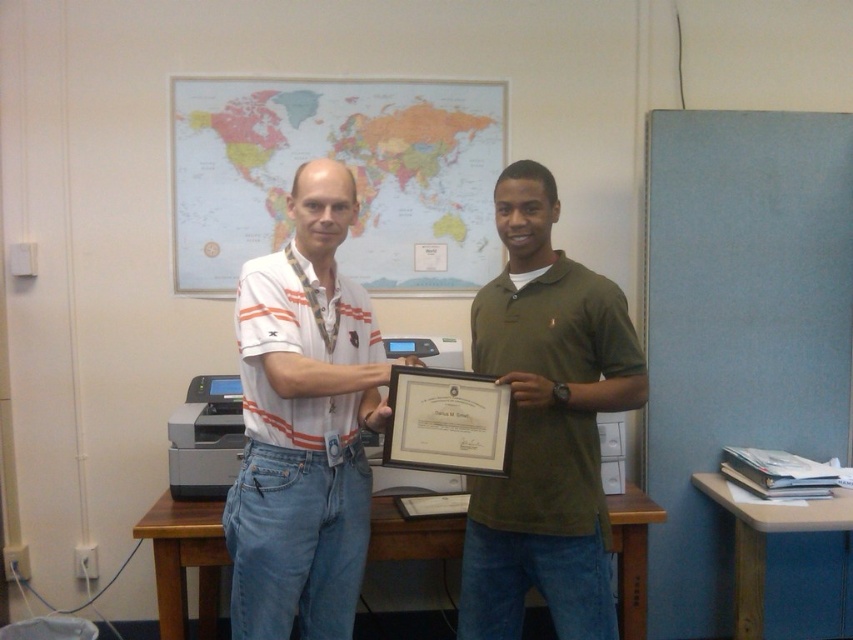
What are the coordinates of the white striped polo shirt at center?

The white striped polo shirt at center is located at coordinates point (305, 422).

You are standing in the office scene and need to place a small plant exactly at point (x=300, y=525). If you are currently 2 meters away from this point, how many steps backward should you take to be exactly at the point?

The distance of point (x=300, y=525) from viewer is 1.78 meters. Since you are currently 2 meters away, you need to move backward by 0.22 meters. Assuming each step covers about 0.5 meters, you would need to take 0.44 steps backward. However, since you can only take whole steps, rounding to the nearest whole number, you should take 0 step backward as you are already very close.

You are a photographer trying to capture a clear shot of both the white striped polo shirt at center and the green matte shirt at center. Since you want both shirts to be in focus, which one should you adjust your camera focus on first to ensure both are sharp?

You should focus on the white striped polo shirt at center first because it is closer to the viewer than the green matte shirt at center, ensuring both will be in focus when using a small aperture or adjusting the focal plane accordingly.